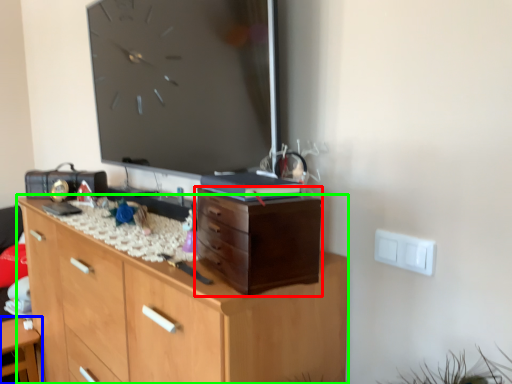
Question: Which object is positioned farthest from chest of drawers (highlighted by a red box)? Select from table (highlighted by a blue box) and chest of drawers (highlighted by a green box).

Choices:
 (A) table
 (B) chest of drawers

Answer: (A)